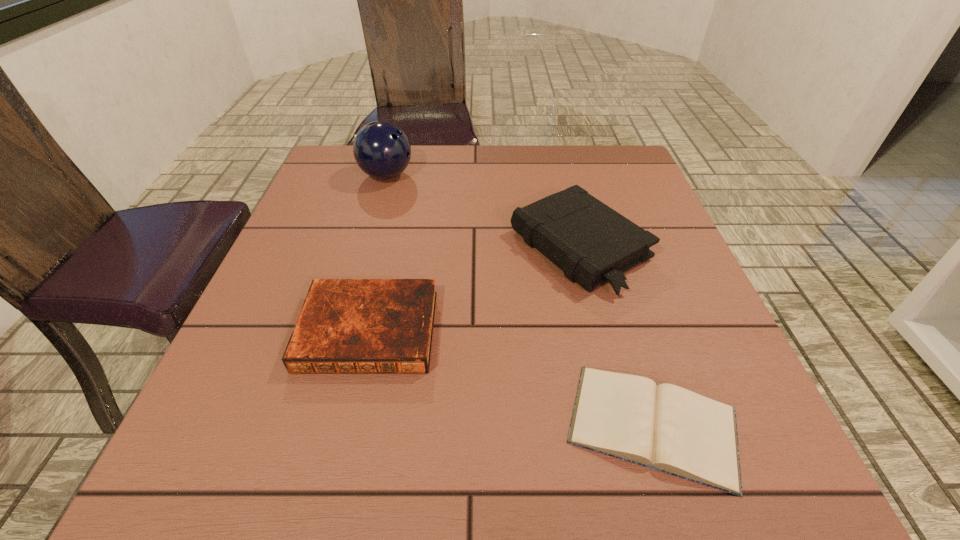
The image size is (960, 540). Find the location of `the farthest object`. the farthest object is located at coordinates (382, 150).

Identify the location of the tallest object. (382, 150).

Identify the location of the tallest Bible. This screenshot has height=540, width=960. (591, 243).

Find the location of `the second tallest Bible`. the second tallest Bible is located at coordinates (346, 326).

What are the coordinates of `the leftmost Bible` in the screenshot? It's located at (346, 326).

You are a GUI agent. You are given a task and a screenshot of the screen. Output one action in this format:
    pyautogui.click(x=<x>, y=<y>)
    Task: Click on the shortest object
    This screenshot has width=960, height=540.
    Given the screenshot: What is the action you would take?
    point(665,427)

Image resolution: width=960 pixels, height=540 pixels. I want to click on free space located on the surface of the bowling ball near the finger holes, so click(564, 176).

Identify the location of vacant area located on the left of the tallest Bible. (378, 247).

Where is `free space located 0.090m on the spine side of the second shortest object`? This screenshot has height=540, width=960. free space located 0.090m on the spine side of the second shortest object is located at coordinates (347, 425).

Where is `free space located 0.190m on the left of the shortest object`? free space located 0.190m on the left of the shortest object is located at coordinates (439, 425).